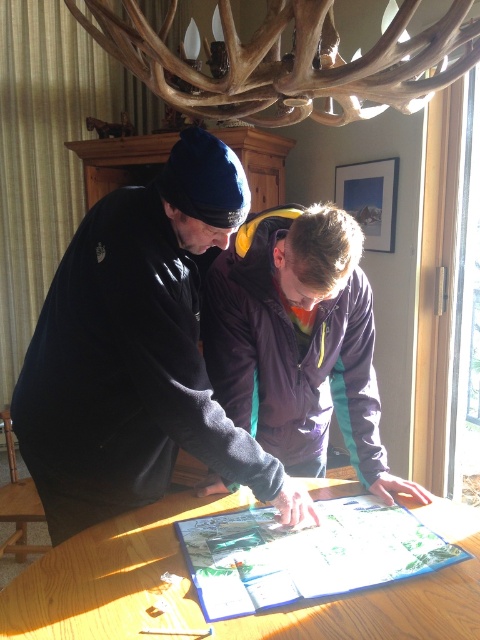
Based on the photo, can you confirm if purple fleece jacket at center is positioned to the right of wooden table at center?

Indeed, purple fleece jacket at center is positioned on the right side of wooden table at center.

Between purple fleece jacket at center and wooden table at center, which one appears on the right side from the viewer's perspective?

Positioned to the right is purple fleece jacket at center.

Who is more distant from viewer, (307, 356) or (389, 596)?

The point (307, 356) is behind.

Image resolution: width=480 pixels, height=640 pixels. I want to click on purple fleece jacket at center, so click(298, 340).

Can you confirm if dark blue fleece jacket at center is thinner than wooden table at center?

Correct, dark blue fleece jacket at center's width is less than wooden table at center's.

Can you confirm if dark blue fleece jacket at center is positioned above wooden table at center?

Indeed, dark blue fleece jacket at center is positioned over wooden table at center.

Based on the photo, who is more distant from viewer, (x=92, y=378) or (x=93, y=614)?

Point (x=92, y=378)

You are a GUI agent. You are given a task and a screenshot of the screen. Output one action in this format:
    pyautogui.click(x=<x>, y=<y>)
    Task: Click on the dark blue fleece jacket at center
    
    Given the screenshot: What is the action you would take?
    pyautogui.click(x=136, y=353)

Is point (167, 305) more distant than point (333, 346)?

That is False.

Which is more to the right, dark blue fleece jacket at center or purple fleece jacket at center?

From the viewer's perspective, purple fleece jacket at center appears more on the right side.

This screenshot has width=480, height=640. What are the coordinates of `dark blue fleece jacket at center` in the screenshot? It's located at (136, 353).

You are a GUI agent. You are given a task and a screenshot of the screen. Output one action in this format:
    pyautogui.click(x=<x>, y=<y>)
    Task: Click on the dark blue fleece jacket at center
    The width and height of the screenshot is (480, 640).
    Given the screenshot: What is the action you would take?
    pyautogui.click(x=136, y=353)